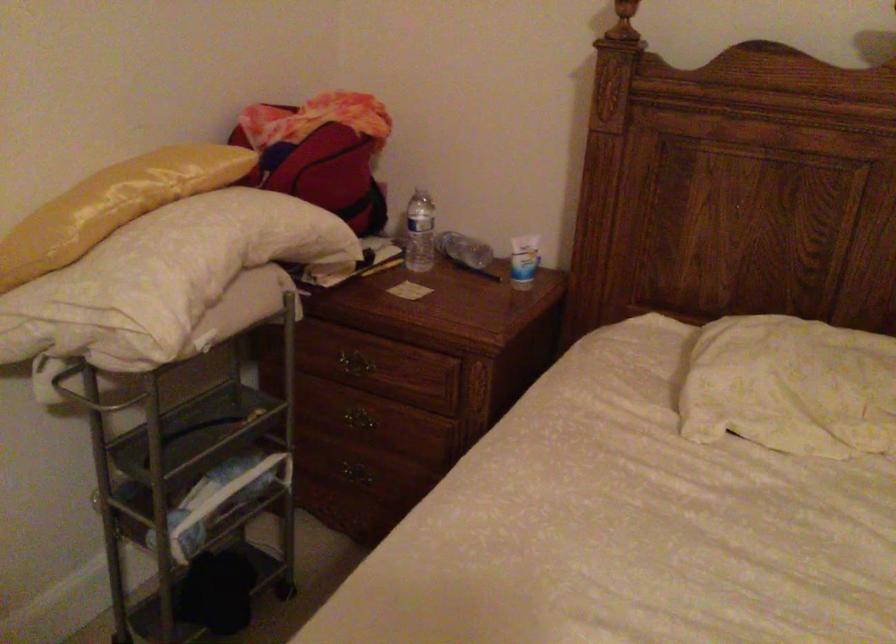
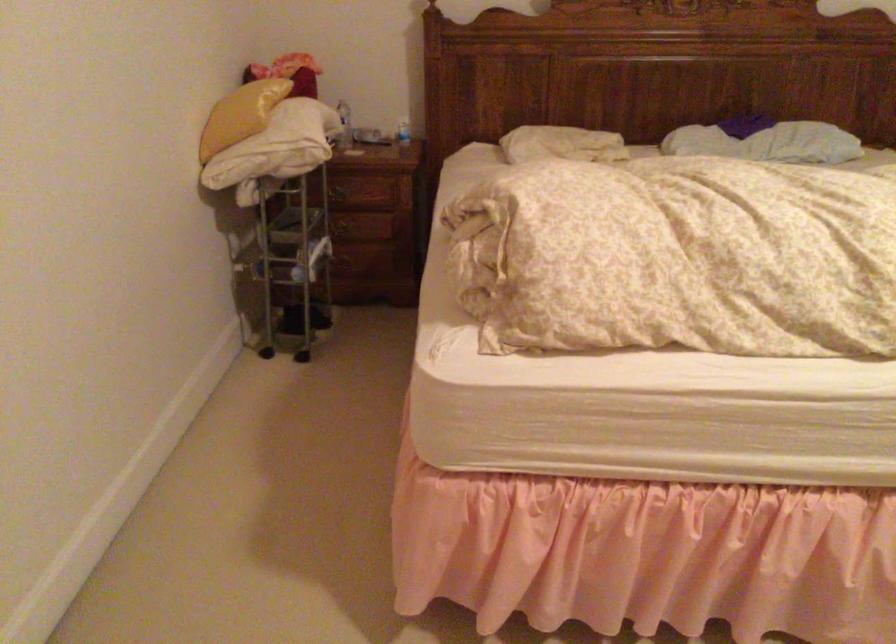
Question: I am providing you with two images of the same scene from different viewpoints. After the viewpoint changes to image2, which objects are now occluded?

Choices:
 (A) metal cart handle
 (B) portable space heater
 (C) yellow pillow
 (D) plastic water bottle

Answer: (A)